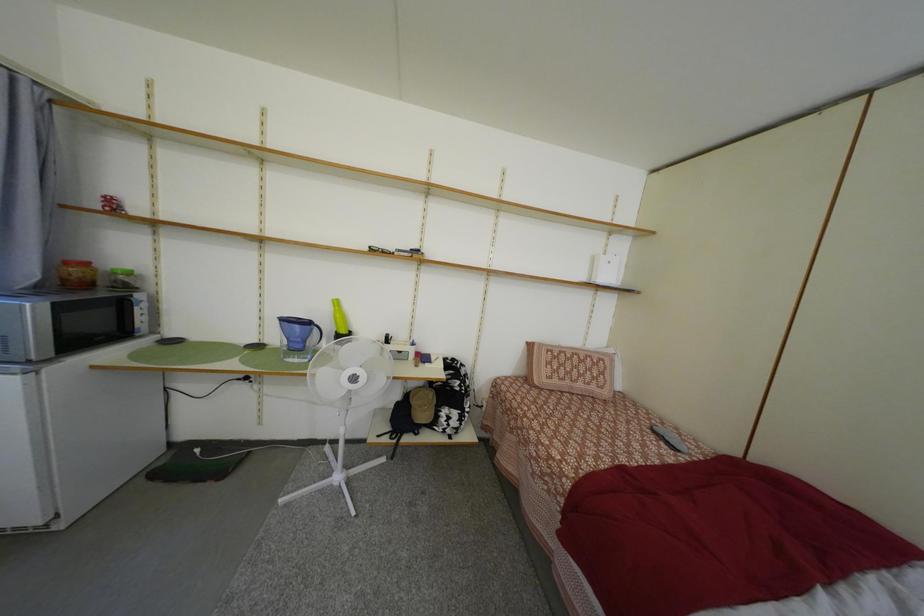
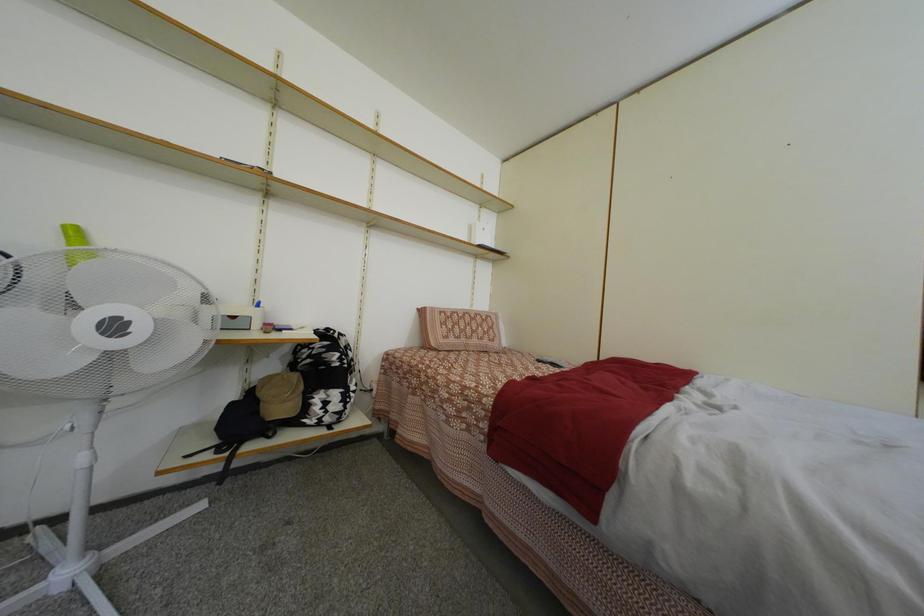
Question: How did the camera likely rotate?

Choices:
 (A) Left
 (B) Right
 (C) Up
 (D) Down

Answer: (B)